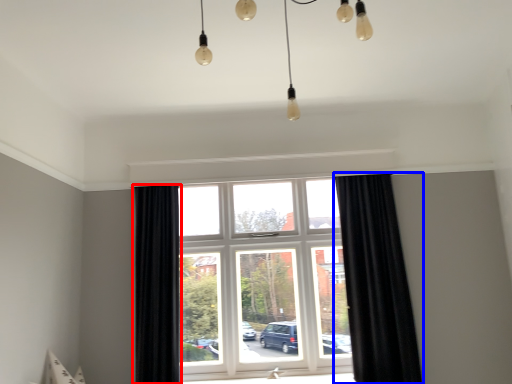
Question: Which point is further to the camera, curtain (highlighted by a red box) or curtain (highlighted by a blue box)?

Choices:
 (A) curtain
 (B) curtain

Answer: (A)